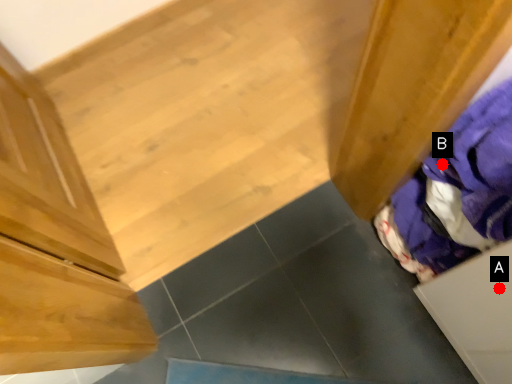
Question: Two points are circled on the image, labeled by A and B beside each circle. Which point is closer to the camera?

Choices:
 (A) A is closer
 (B) B is closer

Answer: (A)